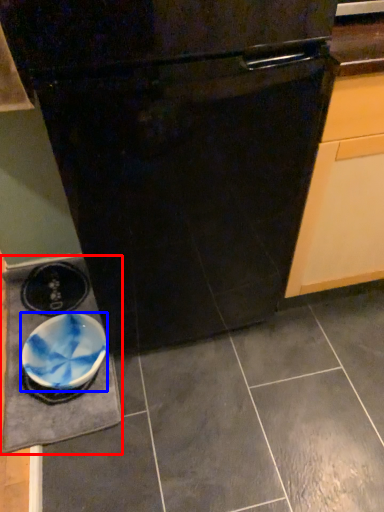
Question: Which object appears closest to the camera in this image, slate (highlighted by a red box) or bowl (highlighted by a blue box)?

Choices:
 (A) slate
 (B) bowl

Answer: (A)